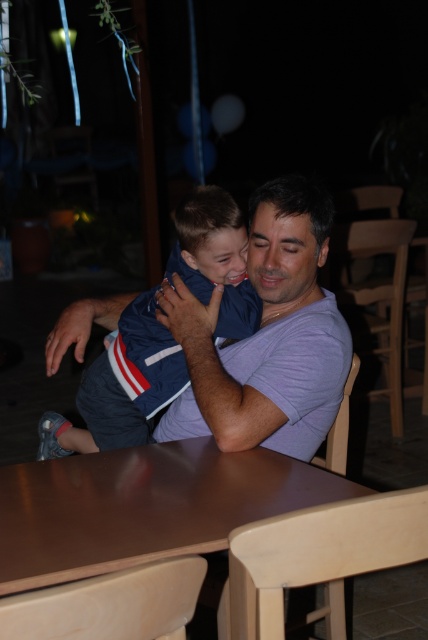
Question: Can you confirm if brown wooden table at center is smaller than blue fabric baby at center?

Choices:
 (A) yes
 (B) no

Answer: (A)

Question: Among these objects, which one is nearest to the camera?

Choices:
 (A) blue fabric baby at center
 (B) brown wooden table at center

Answer: (B)

Question: Can you confirm if brown wooden table at center is wider than blue fabric baby at center?

Choices:
 (A) yes
 (B) no

Answer: (A)

Question: Among these objects, which one is nearest to the camera?

Choices:
 (A) brown wooden table at center
 (B) blue fabric baby at center

Answer: (A)

Question: Is brown wooden table at center below blue fabric baby at center?

Choices:
 (A) yes
 (B) no

Answer: (A)